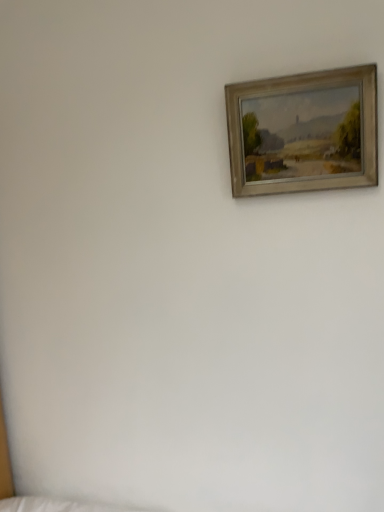
What is the approximate width of wooden-framed painting at upper center?

It is 2.80 inches.

Find the location of a particular element. Image resolution: width=384 pixels, height=512 pixels. wooden-framed painting at upper center is located at coordinates (303, 132).

Describe the element at coordinates (303, 132) in the screenshot. I see `wooden-framed painting at upper center` at that location.

You are a GUI agent. You are given a task and a screenshot of the screen. Output one action in this format:
    pyautogui.click(x=<x>, y=<y>)
    Task: Click on the wooden-framed painting at upper center
    
    Given the screenshot: What is the action you would take?
    pyautogui.click(x=303, y=132)